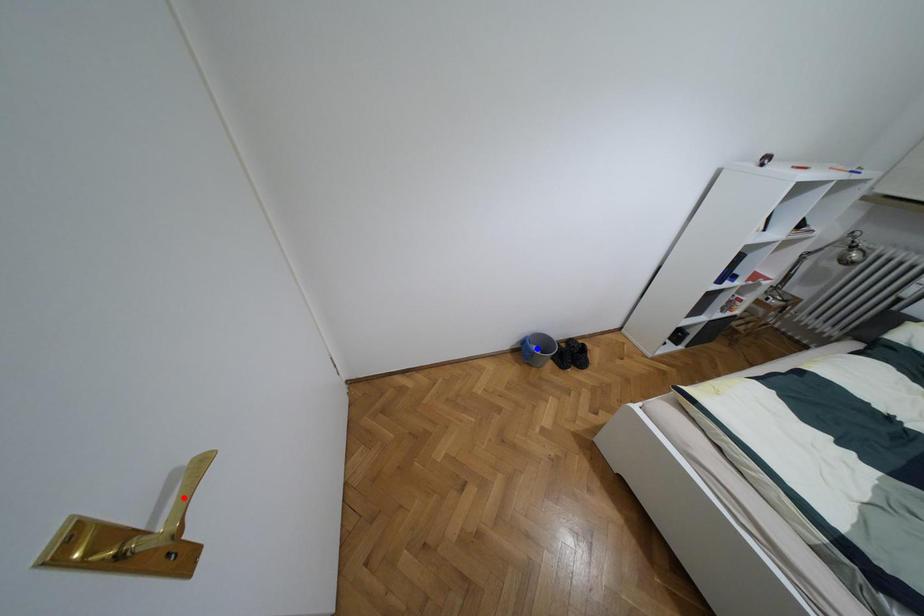
Question: In the image, two points are highlighted. Which point is nearer to the camera? Reply with the corresponding letter.

Choices:
 (A) blue point
 (B) red point

Answer: (B)